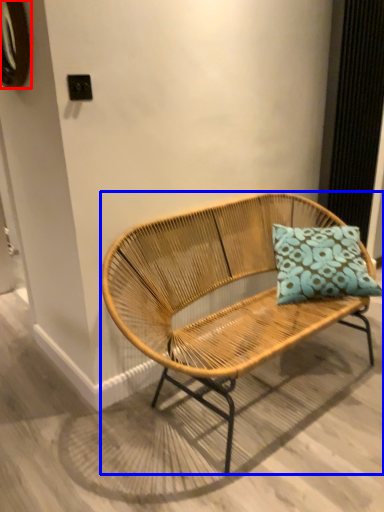
Question: Among these objects, which one is farthest to the camera, oval (highlighted by a red box) or bench (highlighted by a blue box)?

Choices:
 (A) oval
 (B) bench

Answer: (A)